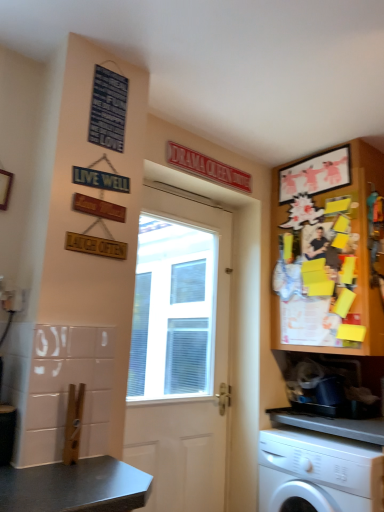
Measure the distance between wooden bulletin board at upper right and camera.

They are 6.30 feet apart.

Image resolution: width=384 pixels, height=512 pixels. In order to click on wooden bulletin board at upper right in this screenshot , I will do `click(326, 253)`.

Is wooden bulletin board at upper right bigger or smaller than white plastic washing machine at lower right?

Clearly, wooden bulletin board at upper right is larger in size than white plastic washing machine at lower right.

Does wooden bulletin board at upper right lie in front of white plastic washing machine at lower right?

No, wooden bulletin board at upper right is further to the viewer.

From the image's perspective, which is above, wooden bulletin board at upper right or white plastic washing machine at lower right?

wooden bulletin board at upper right appears higher in the image.

From the image's perspective, between white wooden door at center and white plastic washing machine at lower right, who is located below?

white plastic washing machine at lower right appears lower in the image.

At what (x,y) coordinates should I click in order to perform the action: click on door located above the white plastic washing machine at lower right (from the image's perspective). Please return your answer as a coordinate pair (x, y). Looking at the image, I should click on (186, 298).

Can you confirm if white wooden door at center is bigger than white plastic washing machine at lower right?

Actually, white wooden door at center might be smaller than white plastic washing machine at lower right.

Can we say white wooden door at center lies outside white plastic washing machine at lower right?

That's correct, white wooden door at center is outside of white plastic washing machine at lower right.

Is wooden bulletin board at upper right not close to white wooden door at center?

That's right, there is a large distance between wooden bulletin board at upper right and white wooden door at center.

Considering the sizes of objects wooden bulletin board at upper right and white wooden door at center in the image provided, who is bigger, wooden bulletin board at upper right or white wooden door at center?

With larger size is wooden bulletin board at upper right.

Relative to white wooden door at center, is wooden bulletin board at upper right in front or behind?

Visually, wooden bulletin board at upper right is located behind white wooden door at center.

From the image's perspective, between wooden bulletin board at upper right and white wooden door at center, who is located below?

white wooden door at center appears lower in the image.

Is white plastic washing machine at lower right not close to white wooden door at center?

Yes.

From the image's perspective, would you say white plastic washing machine at lower right is shown under white wooden door at center?

Yes.

Which of these two, white plastic washing machine at lower right or white wooden door at center, stands shorter?

With less height is white plastic washing machine at lower right.

From their relative heights in the image, would you say white wooden door at center is taller or shorter than wooden bulletin board at upper right?

In the image, white wooden door at center appears to be taller than wooden bulletin board at upper right.

Does white wooden door at center lie behind wooden bulletin board at upper right?

No, it is in front of wooden bulletin board at upper right.

This screenshot has height=512, width=384. In order to click on cabinetry above the white wooden door at center (from the image's perspective) in this screenshot , I will do `click(326, 253)`.

Does white wooden door at center have a smaller size compared to wooden bulletin board at upper right?

Yes, white wooden door at center is smaller than wooden bulletin board at upper right.

Is white plastic washing machine at lower right shorter than wooden bulletin board at upper right?

Yes.

Does white plastic washing machine at lower right have a smaller size compared to wooden bulletin board at upper right?

Yes, white plastic washing machine at lower right is smaller than wooden bulletin board at upper right.

Is white plastic washing machine at lower right not near wooden bulletin board at upper right?

No, there isn't a large distance between white plastic washing machine at lower right and wooden bulletin board at upper right.

In the scene shown: Considering the relative sizes of white plastic washing machine at lower right and wooden bulletin board at upper right in the image provided, is white plastic washing machine at lower right thinner than wooden bulletin board at upper right?

Yes, white plastic washing machine at lower right is thinner than wooden bulletin board at upper right.

Locate an element on the screen. The height and width of the screenshot is (512, 384). washing machine that is on the left side of wooden bulletin board at upper right is located at coordinates [x=322, y=467].

Where is `washing machine that is under the white wooden door at center (from a real-world perspective)`? This screenshot has width=384, height=512. washing machine that is under the white wooden door at center (from a real-world perspective) is located at coordinates (322, 467).

Which object lies nearer to the anchor point white wooden door at center, wooden bulletin board at upper right or white plastic washing machine at lower right?

Based on the image, wooden bulletin board at upper right appears to be nearer to white wooden door at center.

Which object lies further to the anchor point white plastic washing machine at lower right, wooden bulletin board at upper right or white wooden door at center?

white wooden door at center lies further to white plastic washing machine at lower right than the other object.

Based on their spatial positions, is white wooden door at center or white plastic washing machine at lower right closer to wooden bulletin board at upper right?

Based on the image, white plastic washing machine at lower right appears to be nearer to wooden bulletin board at upper right.

Based on their spatial positions, is white wooden door at center or wooden bulletin board at upper right closer to white plastic washing machine at lower right?

Based on the image, wooden bulletin board at upper right appears to be nearer to white plastic washing machine at lower right.

Looking at the image, which one is located further to white wooden door at center, white plastic washing machine at lower right or wooden bulletin board at upper right?

white plastic washing machine at lower right.

Looking at the image, which one is located closer to wooden bulletin board at upper right, white plastic washing machine at lower right or white wooden door at center?

white plastic washing machine at lower right.

Identify the location of door that lies between wooden bulletin board at upper right and white plastic washing machine at lower right from top to bottom. (186, 298).